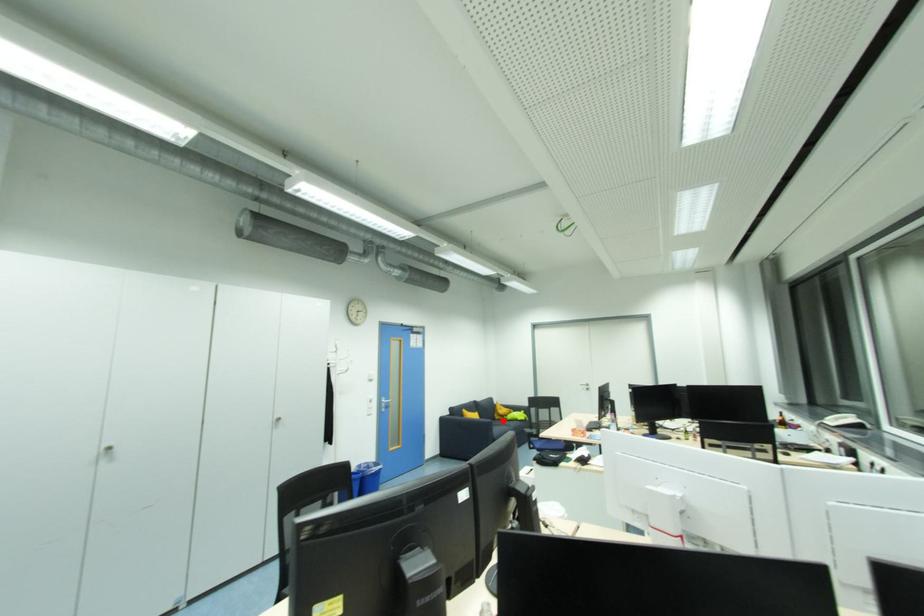
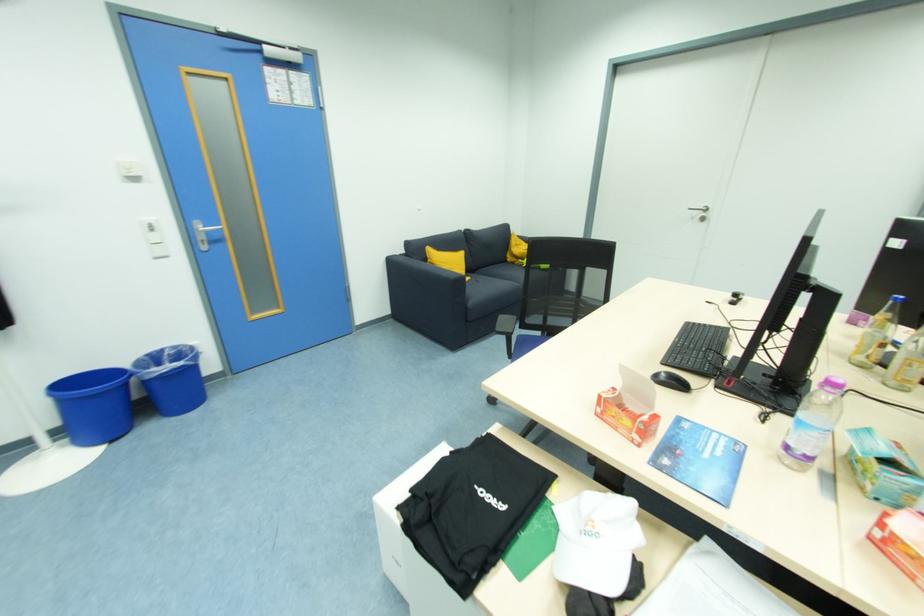
Question: I am providing you with two images of the same scene from different viewpoints. In image1, a red point is highlighted. Considering the same 3D point in image2, which of the following is correct?

Choices:
 (A) It is closer
 (B) It is farther

Answer: (A)